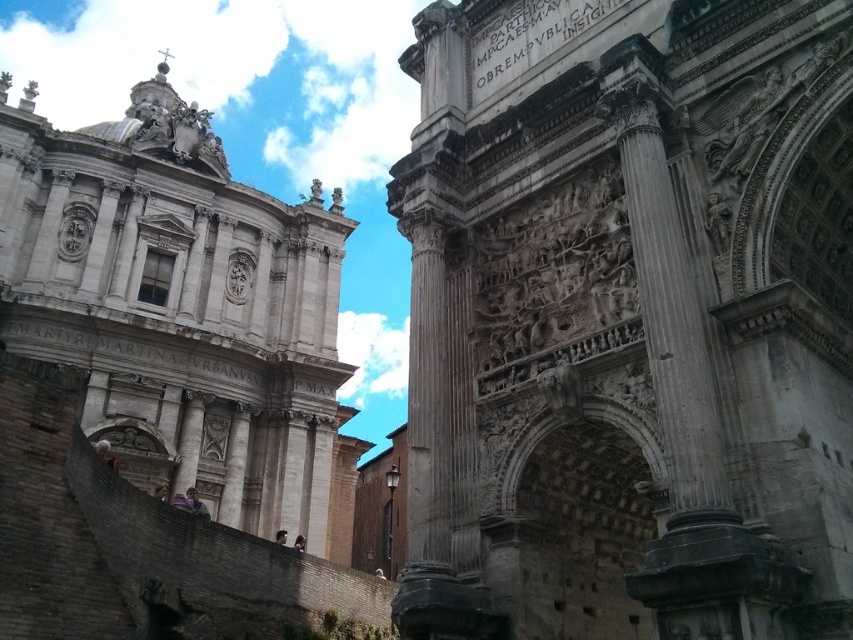
Question: Where is gray stone arch at center located in relation to white stone tower at upper left in the image?

Choices:
 (A) left
 (B) right

Answer: (B)

Question: Observing the image, what is the correct spatial positioning of gray stone arch at center in reference to white stone tower at upper left?

Choices:
 (A) right
 (B) left

Answer: (A)

Question: Which object is farther from the camera taking this photo?

Choices:
 (A) gray stone arch at center
 (B) white stone tower at upper left

Answer: (B)

Question: Which point is farther to the camera?

Choices:
 (A) (308, 337)
 (B) (686, 170)

Answer: (A)

Question: Can you confirm if gray stone arch at center is thinner than white stone tower at upper left?

Choices:
 (A) yes
 (B) no

Answer: (A)